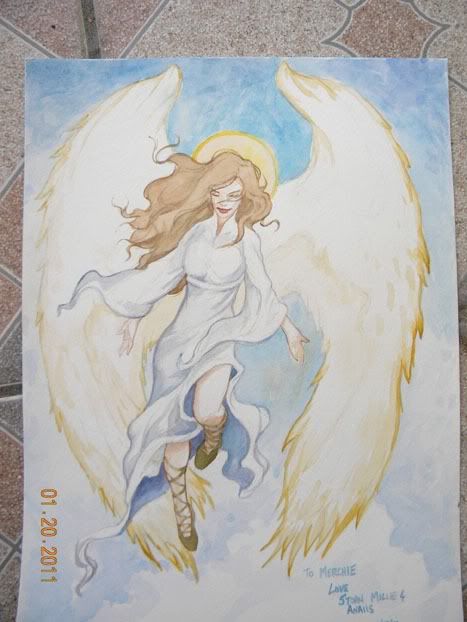
Identify the location of grout. (17, 389), (92, 22).